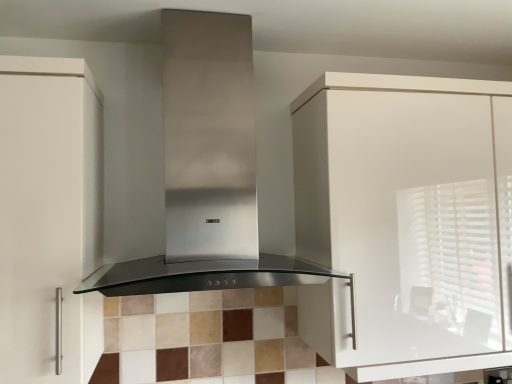
Question: Should I look upward or downward to see white glossy cabinet at upper right, the 1th cabinetry from the right?

Choices:
 (A) down
 (B) up

Answer: (A)

Question: Considering the relative sizes of white glossy cabinet at upper right, which is the 2th cabinetry in left-to-right order, and stainless steel range hood at center in the image provided, is white glossy cabinet at upper right, which is the 2th cabinetry in left-to-right order, taller than stainless steel range hood at center?

Choices:
 (A) yes
 (B) no

Answer: (A)

Question: Considering the relative sizes of white glossy cabinet at upper right, which is the 2th cabinetry in left-to-right order, and stainless steel range hood at center in the image provided, is white glossy cabinet at upper right, which is the 2th cabinetry in left-to-right order, smaller than stainless steel range hood at center?

Choices:
 (A) no
 (B) yes

Answer: (A)

Question: Is white glossy cabinet at upper right, which is the 2th cabinetry in left-to-right order, shorter than stainless steel range hood at center?

Choices:
 (A) no
 (B) yes

Answer: (A)

Question: From the image's perspective, is white glossy cabinet at upper right, the 1th cabinetry from the right, below stainless steel range hood at center?

Choices:
 (A) yes
 (B) no

Answer: (A)

Question: Is white glossy cabinet at upper right, the 1th cabinetry from the right, outside stainless steel range hood at center?

Choices:
 (A) yes
 (B) no

Answer: (A)

Question: Considering the relative positions of white glossy cabinet at upper right, the 1th cabinetry from the right, and stainless steel range hood at center in the image provided, is white glossy cabinet at upper right, the 1th cabinetry from the right, to the left of stainless steel range hood at center from the viewer's perspective?

Choices:
 (A) no
 (B) yes

Answer: (A)

Question: Considering the relative sizes of white matte cabinet at left, the 1th cabinetry viewed from the left, and stainless steel range hood at center in the image provided, is white matte cabinet at left, the 1th cabinetry viewed from the left, shorter than stainless steel range hood at center?

Choices:
 (A) no
 (B) yes

Answer: (A)

Question: Is white matte cabinet at left, the second cabinetry viewed from the right, far away from stainless steel range hood at center?

Choices:
 (A) no
 (B) yes

Answer: (A)

Question: From a real-world perspective, is white matte cabinet at left, the 1th cabinetry viewed from the left, over stainless steel range hood at center?

Choices:
 (A) yes
 (B) no

Answer: (B)

Question: Can stainless steel range hood at center be found inside white matte cabinet at left, the second cabinetry viewed from the right?

Choices:
 (A) no
 (B) yes

Answer: (A)

Question: Does white matte cabinet at left, the second cabinetry viewed from the right, appear on the left side of stainless steel range hood at center?

Choices:
 (A) yes
 (B) no

Answer: (A)

Question: Is the depth of white matte cabinet at left, the 1th cabinetry viewed from the left, greater than that of stainless steel range hood at center?

Choices:
 (A) no
 (B) yes

Answer: (B)

Question: Is stainless steel range hood at center smaller than white glossy cabinet at upper right, the 1th cabinetry from the right?

Choices:
 (A) yes
 (B) no

Answer: (A)